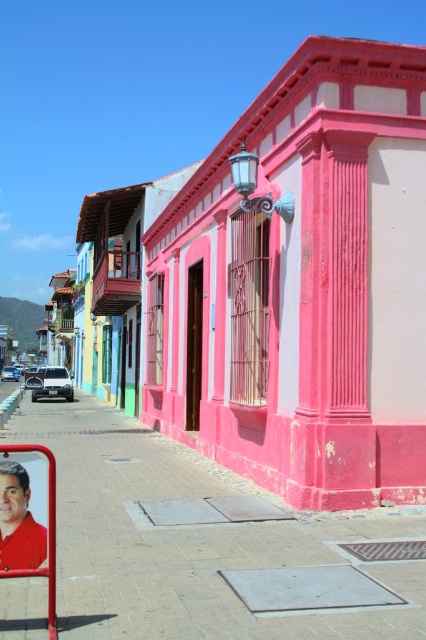
Which is in front, point (290, 323) or point (17, 369)?

Point (290, 323)

Which is below, pink painted building at center or white matte car at center?

Positioned lower is white matte car at center.

Between point (233, 257) and point (5, 369), which one is positioned behind?

The point (5, 369) is behind.

Where is `pink painted building at center`? This screenshot has height=640, width=426. pink painted building at center is located at coordinates pyautogui.click(x=281, y=285).

Who is positioned more to the left, pink painted building at center or white matte car at left?

Positioned to the left is white matte car at left.

Does pink painted building at center have a larger size compared to white matte car at left?

Correct, pink painted building at center is larger in size than white matte car at left.

Between point (293, 484) and point (69, 390), which one is positioned behind?

Point (69, 390)

This screenshot has width=426, height=640. I want to click on pink painted building at center, so click(x=281, y=285).

Does pink painted building at center appear on the left side of smooth red shirt at lower left?

Correct, you'll find pink painted building at center to the left of smooth red shirt at lower left.

Is pink painted building at center closer to the viewer compared to smooth red shirt at lower left?

No, pink painted building at center is behind smooth red shirt at lower left.

Is point (397, 61) behind point (9, 483)?

Yes, it is behind point (9, 483).

Locate an element on the screen. pink painted building at center is located at coordinates (281, 285).